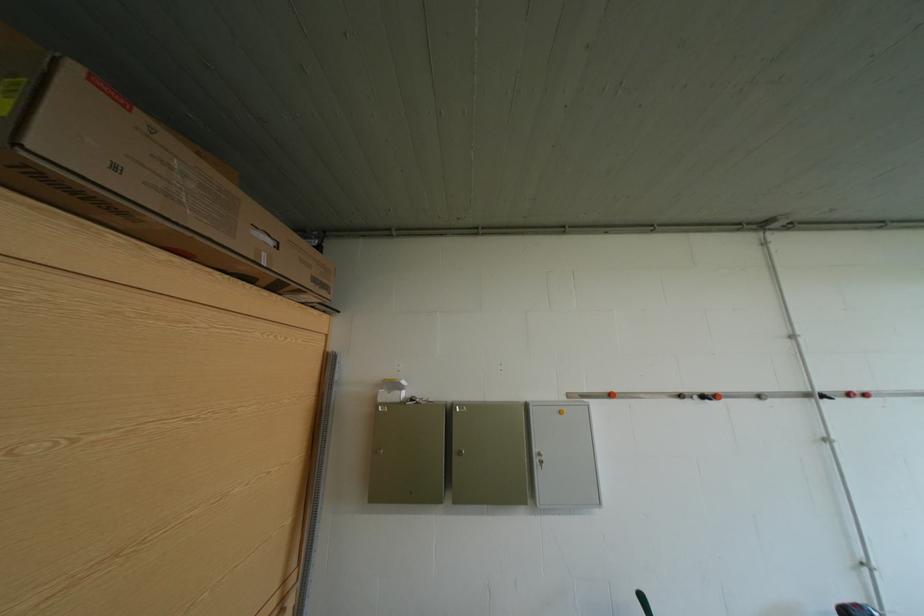
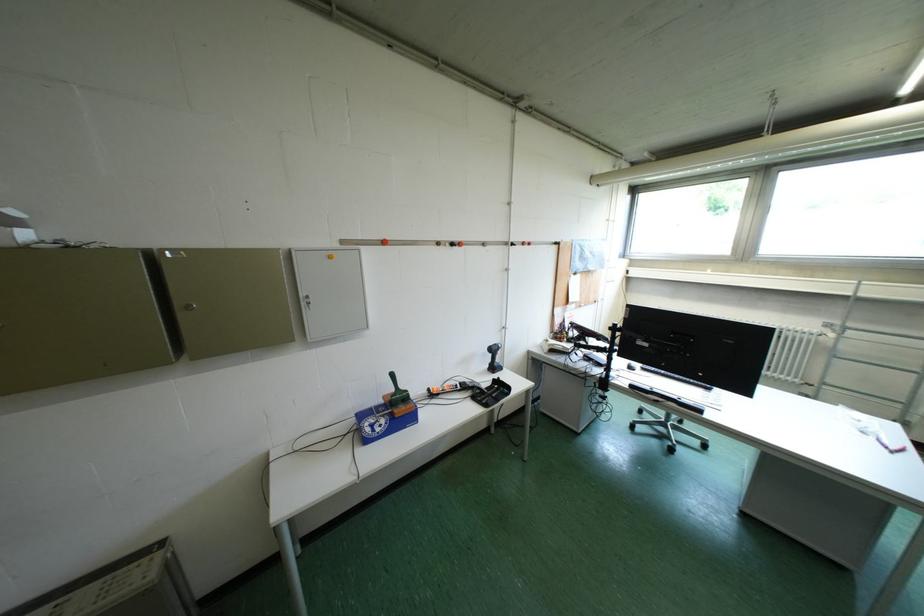
Looking at this image, the first image is from the beginning of the video and the second image is from the end. How did the camera likely rotate when shooting the video?

The rotation direction of the camera is right-down.